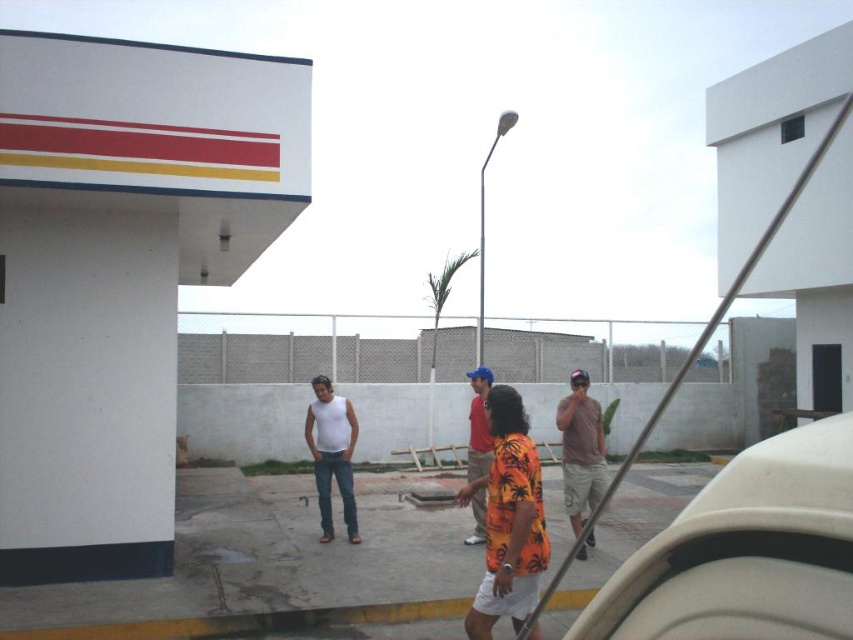
Question: Observing the image, what is the correct spatial positioning of white plastic car at right in reference to orange palm print shirt at center?

Choices:
 (A) left
 (B) right

Answer: (B)

Question: Is orange palm print shirt at center to the right of white matte tank top at center from the viewer's perspective?

Choices:
 (A) yes
 (B) no

Answer: (A)

Question: Which point is closer to the camera?

Choices:
 (A) (328, 518)
 (B) (473, 394)
 (C) (689, 548)
 (D) (566, 484)

Answer: (C)

Question: Among these objects, which one is nearest to the camera?

Choices:
 (A) white plastic car at right
 (B) orange palm print shirt at center

Answer: (A)

Question: Is white matte tank top at center smaller than orange printed shirt at center?

Choices:
 (A) no
 (B) yes

Answer: (A)

Question: Which object appears closest to the camera in this image?

Choices:
 (A) orange printed shirt at center
 (B) white plastic car at right

Answer: (B)